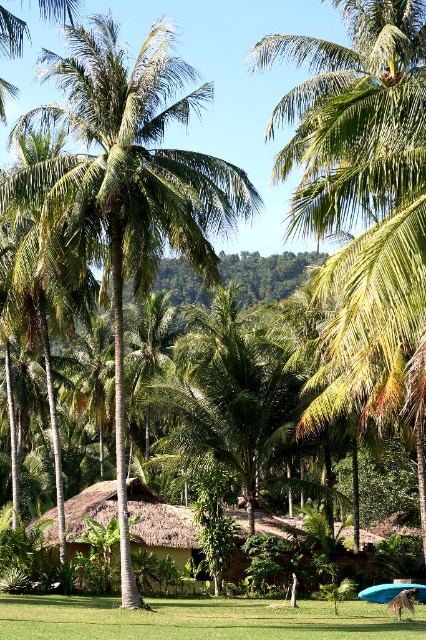
In the scene shown: Can you confirm if green leafy palm tree at center is positioned below green grass at lower center?

No.

Who is shorter, green leafy palm tree at center or green grass at lower center?

green grass at lower center

Who is more distant from viewer, [178,112] or [9,595]?

Point [9,595]

The width and height of the screenshot is (426, 640). Identify the location of green leafy palm tree at center. (129, 182).